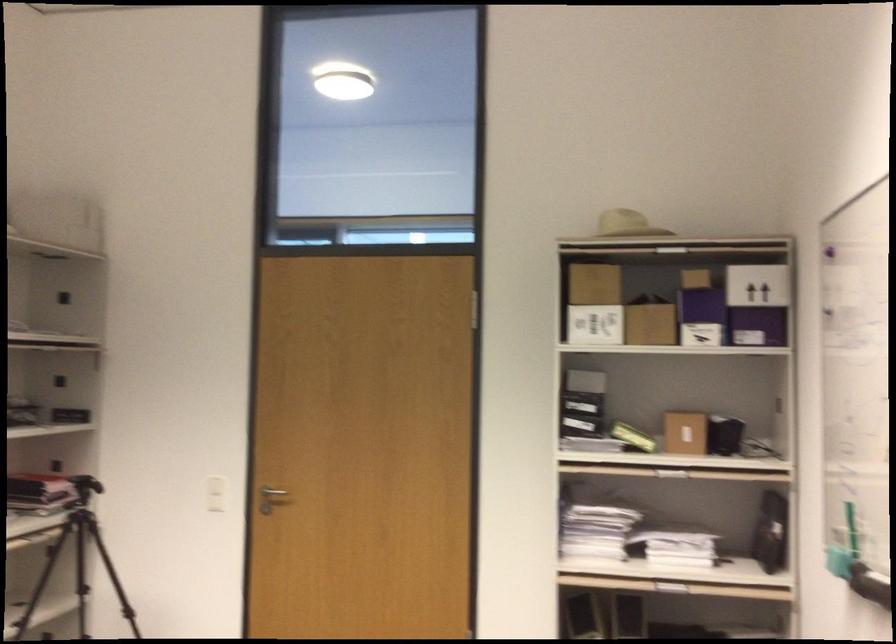
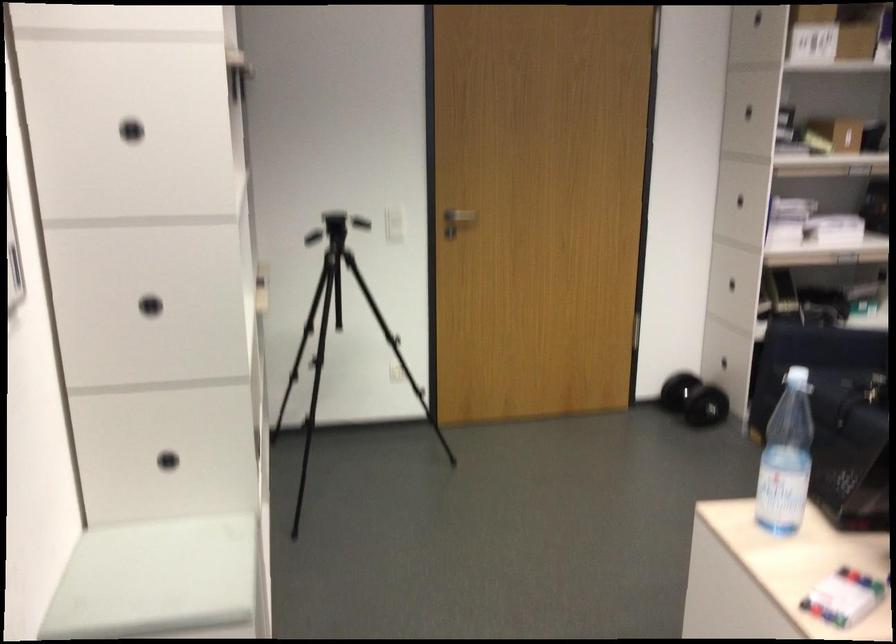
The point at [306,491] is marked in the first image. Where is the corresponding point in the second image?

(460, 216)